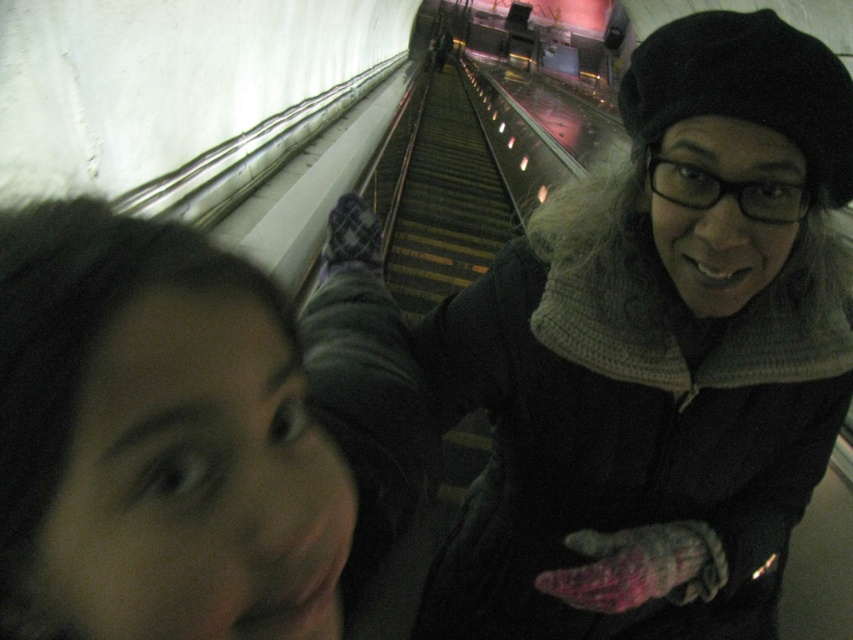
Does knitted gray scarf at upper center appear on the left side of matte black hair at upper left?

Incorrect, knitted gray scarf at upper center is not on the left side of matte black hair at upper left.

Who is more forward, (572, 586) or (103, 609)?

Point (103, 609)

Which is in front, point (457, 608) or point (137, 628)?

Point (137, 628)

Where is `knitted gray scarf at upper center`? The width and height of the screenshot is (853, 640). knitted gray scarf at upper center is located at coordinates (630, 348).